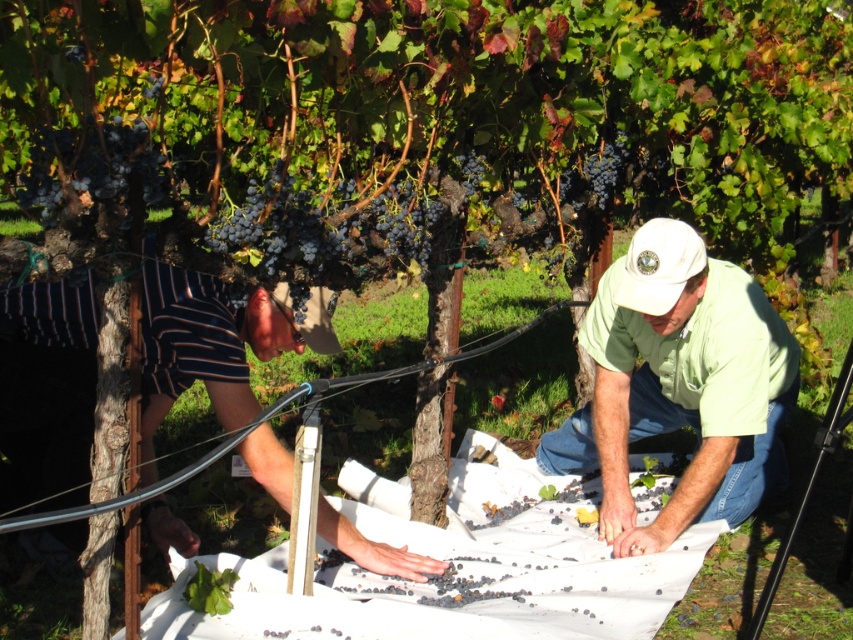
From the picture: You are a photographer trying to capture a clear shot of the dark purple grapes at center without any obstruction. You notice the striped cotton shorts at lower left might block your view. Based on their positions, can you position yourself so the grapes are visible without the shorts blocking them?

The striped cotton shorts at lower left is in front of dark purple grapes at center, so to capture the grapes without obstruction, move to a position where you can angle your camera around or above the shorts to ensure the grapes are visible behind them.

Looking at this image, you are a grape farmer who needs to collect all the grapes in the vineyard. You see the dark purple grapes at center and the shiny purple grape at center. Which grape cluster is closer to you?

The dark purple grapes at center are closer to you because the shiny purple grape at center is behind them.

You are a farmer checking the grape harvest. You see the ripe dark purple grapes at upper left and the dark purple grapes at center. Which group of grapes is higher in the image?

The ripe dark purple grapes at upper left are taller than the dark purple grapes at center, so they are higher in the image.